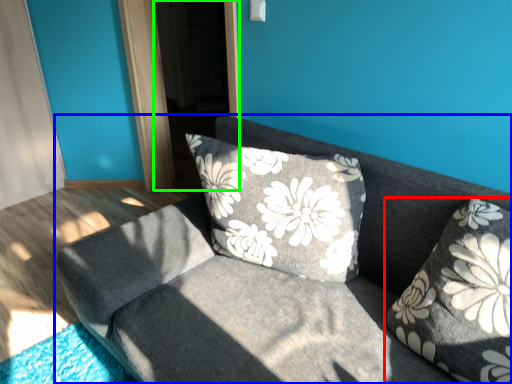
Question: Which object is the farthest from pillow (highlighted by a red box)? Choose among these: studio couch (highlighted by a blue box) or screen door (highlighted by a green box).

Choices:
 (A) studio couch
 (B) screen door

Answer: (B)